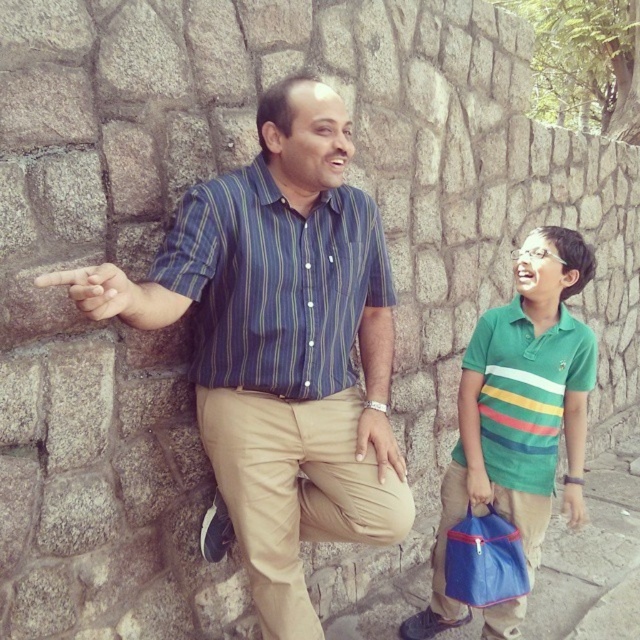
Question: Based on their relative distances, which object is farther from the green fabric handbag at lower right?

Choices:
 (A) blue fabric bag at lower right
 (B) blue striped shirt at center
 (C) striped cotton shirt at center

Answer: (C)

Question: Can you confirm if khaki cotton pants at center is thinner than green fabric handbag at lower right?

Choices:
 (A) no
 (B) yes

Answer: (A)

Question: Does blue striped shirt at center appear under green fabric handbag at lower right?

Choices:
 (A) yes
 (B) no

Answer: (B)

Question: Which point appears farthest from the camera in this image?

Choices:
 (A) (468, 579)
 (B) (492, 340)

Answer: (B)

Question: Does blue striped shirt at center have a lesser width compared to green striped polo shirt at right?

Choices:
 (A) yes
 (B) no

Answer: (A)

Question: Which object is positioned closest to the blue striped shirt at center?

Choices:
 (A) khaki cotton pants at center
 (B) matte skin hand at left

Answer: (A)